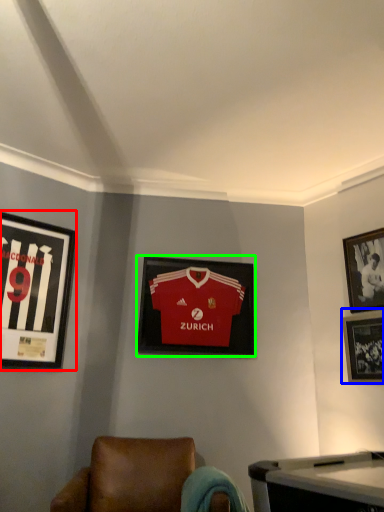
Question: Which object is the farthest from picture frame (highlighted by a red box)? Choose among these: picture frame (highlighted by a blue box) or picture frame (highlighted by a green box).

Choices:
 (A) picture frame
 (B) picture frame

Answer: (A)